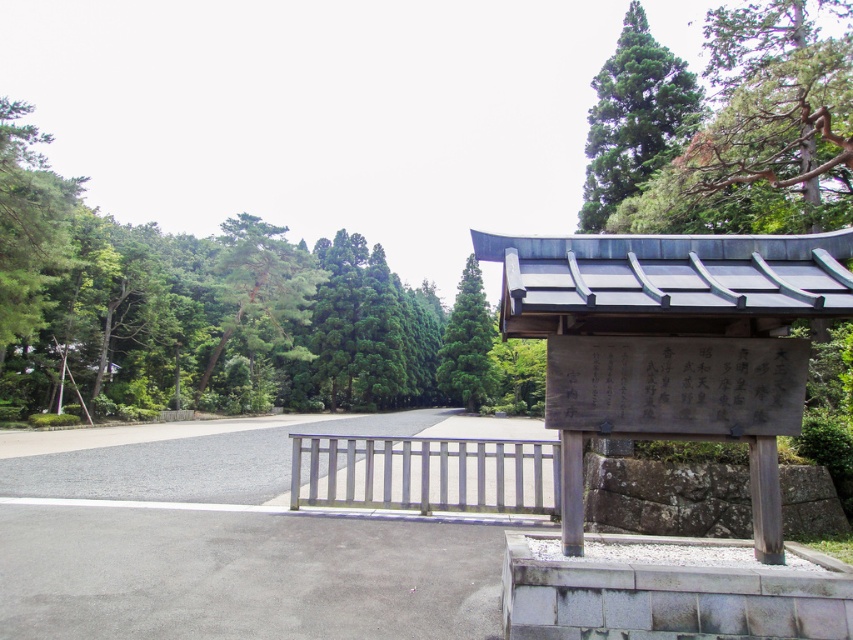
Does green leafy trees at left have a lesser width compared to green textured tree at upper right?

No, green leafy trees at left is not thinner than green textured tree at upper right.

Is green leafy trees at left bigger than green textured tree at upper right?

Correct, green leafy trees at left is larger in size than green textured tree at upper right.

Does point (370, 266) come farther from viewer compared to point (793, 113)?

Yes, it is.

Locate an element on the screen. green leafy trees at left is located at coordinates pos(225,314).

Which of these two, green leafy trees at left or white stone plaque at center, stands shorter?

white stone plaque at center is shorter.

Which is more to the right, green leafy trees at left or white stone plaque at center?

white stone plaque at center

The width and height of the screenshot is (853, 640). Describe the element at coordinates (225, 314) in the screenshot. I see `green leafy trees at left` at that location.

The height and width of the screenshot is (640, 853). I want to click on green leafy trees at left, so click(x=225, y=314).

Does white painted wood rail at center have a lesser width compared to green matte tree at center?

No, white painted wood rail at center is not thinner than green matte tree at center.

Is white painted wood rail at center further to the viewer compared to green matte tree at center?

No, white painted wood rail at center is closer to the viewer.

Identify the location of white painted wood rail at center. (425, 474).